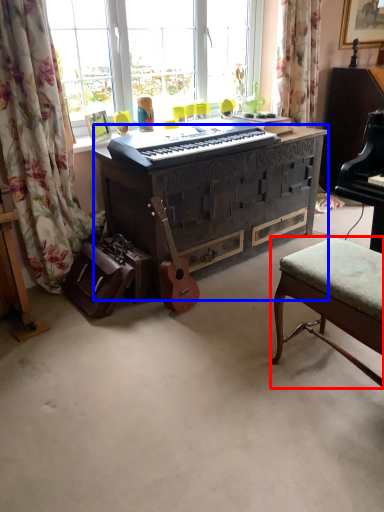
Question: Which object is further to the camera taking this photo, stool (highlighted by a red box) or desk (highlighted by a blue box)?

Choices:
 (A) stool
 (B) desk

Answer: (B)